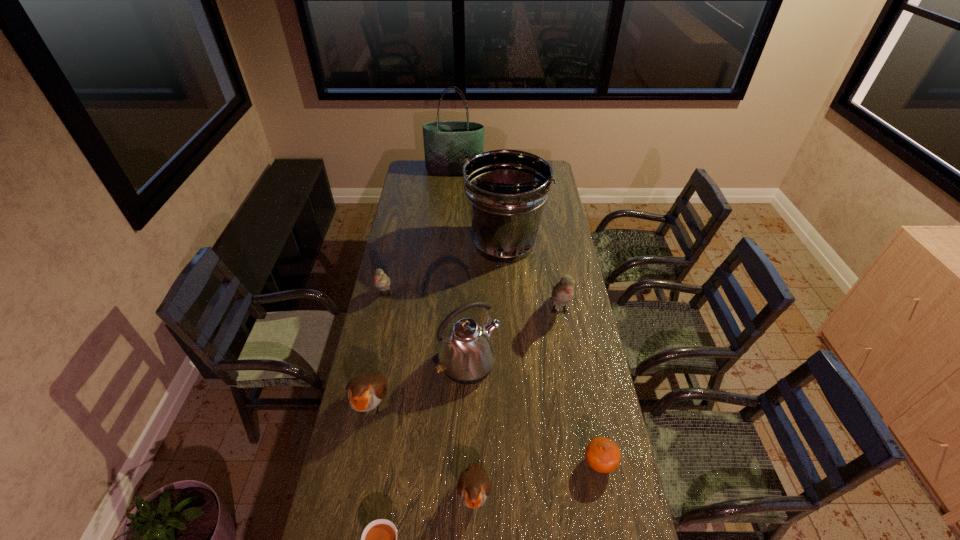
I want to click on vacant space that satisfies the following two spatial constraints: 1. at the face of the orange; 2. on the left side of the smaller white bird, so click(349, 463).

You are a GUI agent. You are given a task and a screenshot of the screen. Output one action in this format:
    pyautogui.click(x=<x>, y=<y>)
    Task: Click on the vacant region that satisfies the following two spatial constraints: 1. at the face of the tallest bird; 2. on the right side of the second shortest object
    
    Given the screenshot: What is the action you would take?
    pyautogui.click(x=586, y=463)